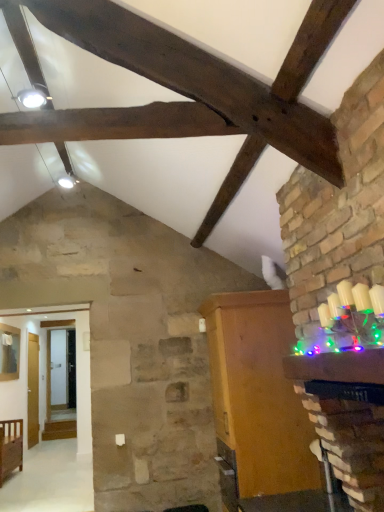
The image size is (384, 512). I want to click on wooden crib at lower left, positioned as the first furniture in left-to-right order, so click(x=10, y=447).

What do you see at coordinates (194, 92) in the screenshot?
I see `brown wooden cabinet at upper center` at bounding box center [194, 92].

Locate an element on the screen. wooden cabinet at right, the second furniture from the bottom is located at coordinates (256, 398).

Which of these two, wooden cabinet at right, which is counted as the 1th furniture, starting from the right, or brown wooden cabinet at upper center, is bigger?

Bigger between the two is wooden cabinet at right, which is counted as the 1th furniture, starting from the right.

The image size is (384, 512). I want to click on furniture that is the 1st one below the brown wooden cabinet at upper center (from a real-world perspective), so click(256, 398).

From a real-world perspective, who is located lower, wooden cabinet at right, the second furniture from the bottom, or brown wooden cabinet at upper center?

From a 3D spatial view, wooden cabinet at right, the second furniture from the bottom, is below.

From the picture: What's the angular difference between wooden cabinet at right, the second furniture viewed from the back, and brown wooden cabinet at upper center's facing directions?

wooden cabinet at right, the second furniture viewed from the back, and brown wooden cabinet at upper center are facing 92.3 degrees away from each other.

In the scene shown: Does wooden crib at lower left, which is counted as the first furniture, starting from the bottom, have a lesser width compared to wooden cabinet at right, which is the first furniture from front to back?

Yes.

Is wooden crib at lower left, the 2th furniture in the front-to-back sequence, behind wooden cabinet at right, the second furniture viewed from the back?

Yes, wooden crib at lower left, the 2th furniture in the front-to-back sequence, is further from the camera.

From the image's perspective, is wooden crib at lower left, which is counted as the first furniture, starting from the bottom, over wooden cabinet at right, which is counted as the 1th furniture, starting from the right?

No, from the image's perspective, wooden crib at lower left, which is counted as the first furniture, starting from the bottom, is not on top of wooden cabinet at right, which is counted as the 1th furniture, starting from the right.

Measure the distance between wooden crib at lower left, which is counted as the first furniture, starting from the bottom, and wooden cabinet at right, which is the first furniture from front to back.

wooden crib at lower left, which is counted as the first furniture, starting from the bottom, is 3.45 meters away from wooden cabinet at right, which is the first furniture from front to back.

Locate an element on the screen. exhaust hood on the right side of wooden crib at lower left, positioned as the first furniture in left-to-right order is located at coordinates (194, 92).

From the image's perspective, is wooden crib at lower left, positioned as the first furniture in left-to-right order, located above brown wooden cabinet at upper center?

Actually, wooden crib at lower left, positioned as the first furniture in left-to-right order, appears below brown wooden cabinet at upper center in the image.

Is there a large distance between wooden crib at lower left, positioned as the 2th furniture in right-to-left order, and brown wooden cabinet at upper center?

That's right, there is a large distance between wooden crib at lower left, positioned as the 2th furniture in right-to-left order, and brown wooden cabinet at upper center.

Could wooden cabinet at right, the second furniture viewed from the back, be considered to be inside brown wooden cabinet at upper center?

No, brown wooden cabinet at upper center does not contain wooden cabinet at right, the second furniture viewed from the back.

Which of these two, brown wooden cabinet at upper center or wooden cabinet at right, the 1th furniture when ordered from top to bottom, is bigger?

With larger size is wooden cabinet at right, the 1th furniture when ordered from top to bottom.

Can you tell me how much brown wooden cabinet at upper center and wooden cabinet at right, positioned as the second furniture in left-to-right order, differ in facing direction?

92.3 degrees.

Locate an element on the screen. Image resolution: width=384 pixels, height=512 pixels. exhaust hood above the wooden cabinet at right, the 1th furniture when ordered from top to bottom (from a real-world perspective) is located at coordinates (194, 92).

Looking at this image, from the image's perspective, is brown wooden cabinet at upper center on top of wooden crib at lower left, positioned as the 1th furniture in back-to-front order?

Indeed, from the image's perspective, brown wooden cabinet at upper center is shown above wooden crib at lower left, positioned as the 1th furniture in back-to-front order.

Which object is more forward, brown wooden cabinet at upper center or wooden crib at lower left, which is counted as the first furniture, starting from the bottom?

brown wooden cabinet at upper center.

Can we say brown wooden cabinet at upper center lies outside wooden crib at lower left, which is counted as the first furniture, starting from the bottom?

Yes, brown wooden cabinet at upper center is outside of wooden crib at lower left, which is counted as the first furniture, starting from the bottom.

Between brown wooden cabinet at upper center and wooden crib at lower left, positioned as the 2th furniture in right-to-left order, which one has smaller width?

Thinner between the two is brown wooden cabinet at upper center.

Considering the sizes of objects wooden cabinet at right, which is the first furniture from front to back, and wooden crib at lower left, positioned as the 1th furniture in back-to-front order, in the image provided, who is wider, wooden cabinet at right, which is the first furniture from front to back, or wooden crib at lower left, positioned as the 1th furniture in back-to-front order,?

With larger width is wooden cabinet at right, which is the first furniture from front to back.

From the image's perspective, is wooden cabinet at right, the 1th furniture when ordered from top to bottom, below wooden crib at lower left, the 2th furniture in the front-to-back sequence?

No.

Between wooden cabinet at right, the 1th furniture when ordered from top to bottom, and wooden crib at lower left, the 2th furniture in the front-to-back sequence, which one is positioned behind?

wooden crib at lower left, the 2th furniture in the front-to-back sequence, is more distant.

Is wooden cabinet at right, which is the first furniture from front to back, taller than wooden crib at lower left, positioned as the 1th furniture in back-to-front order?

Yes, wooden cabinet at right, which is the first furniture from front to back, is taller than wooden crib at lower left, positioned as the 1th furniture in back-to-front order.

Find the location of a particular element. The height and width of the screenshot is (512, 384). furniture lying on the right of brown wooden cabinet at upper center is located at coordinates (256, 398).

This screenshot has height=512, width=384. There is a wooden crib at lower left, acting as the second furniture starting from the top. What are the coordinates of `furniture above it (from a real-world perspective)` in the screenshot? It's located at (256, 398).

Which object lies further to the anchor point wooden cabinet at right, which is the first furniture from front to back, wooden crib at lower left, acting as the second furniture starting from the top, or brown wooden cabinet at upper center?

The object further to wooden cabinet at right, which is the first furniture from front to back, is wooden crib at lower left, acting as the second furniture starting from the top.

Looking at the image, which one is located further to brown wooden cabinet at upper center, wooden cabinet at right, the second furniture viewed from the back, or wooden crib at lower left, positioned as the first furniture in left-to-right order?

wooden crib at lower left, positioned as the first furniture in left-to-right order, is positioned further to the anchor brown wooden cabinet at upper center.

From the image, which object appears to be farther from brown wooden cabinet at upper center, wooden crib at lower left, positioned as the first furniture in left-to-right order, or wooden cabinet at right, which is counted as the 1th furniture, starting from the right?

wooden crib at lower left, positioned as the first furniture in left-to-right order, is further to brown wooden cabinet at upper center.

Estimate the real-world distances between objects in this image. Which object is closer to wooden crib at lower left, acting as the second furniture starting from the top, wooden cabinet at right, which is the first furniture from front to back, or brown wooden cabinet at upper center?

wooden cabinet at right, which is the first furniture from front to back, is positioned closer to the anchor wooden crib at lower left, acting as the second furniture starting from the top.

Estimate the real-world distances between objects in this image. Which object is closer to wooden cabinet at right, positioned as the second furniture in left-to-right order, brown wooden cabinet at upper center or wooden crib at lower left, positioned as the first furniture in left-to-right order?

Among the two, brown wooden cabinet at upper center is located nearer to wooden cabinet at right, positioned as the second furniture in left-to-right order.

Looking at the image, which one is located closer to wooden crib at lower left, acting as the second furniture starting from the top, brown wooden cabinet at upper center or wooden cabinet at right, the second furniture from the bottom?

Based on the image, wooden cabinet at right, the second furniture from the bottom, appears to be nearer to wooden crib at lower left, acting as the second furniture starting from the top.

At what (x,y) coordinates should I click in order to perform the action: click on furniture between brown wooden cabinet at upper center and wooden crib at lower left, positioned as the 1th furniture in back-to-front order, along the z-axis. Please return your answer as a coordinate pair (x, y). This screenshot has height=512, width=384. Looking at the image, I should click on (256, 398).